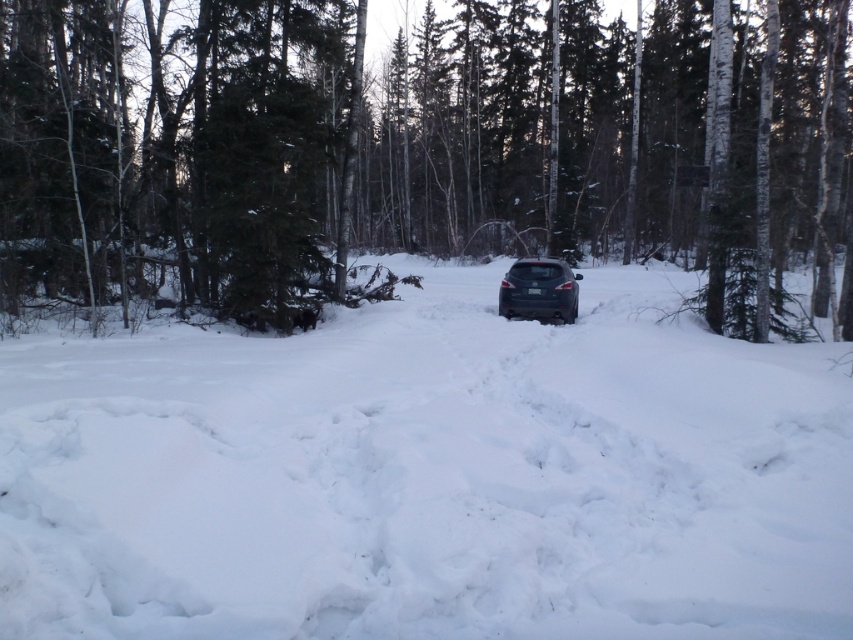
You are a photographer planning to take a picture of the green textured pine tree at center and the satin black car at center in the snowy forest. Which object should you focus on first if you want to capture both in sharp focus?

The green textured pine tree at center is taller than the satin black car at center, so you should focus on the green textured pine tree at center first to ensure both are in sharp focus.

In the scene shown: You are driving a satin black car at center in a snowy forest. You need to park it so that the car is positioned to the right of the white fluffy snow at center. Is this possible based on the current scene?

Yes, since the white fluffy snow at center is already to the left of the satin black car at center, positioning the car to the right of the snow is achievable as described.